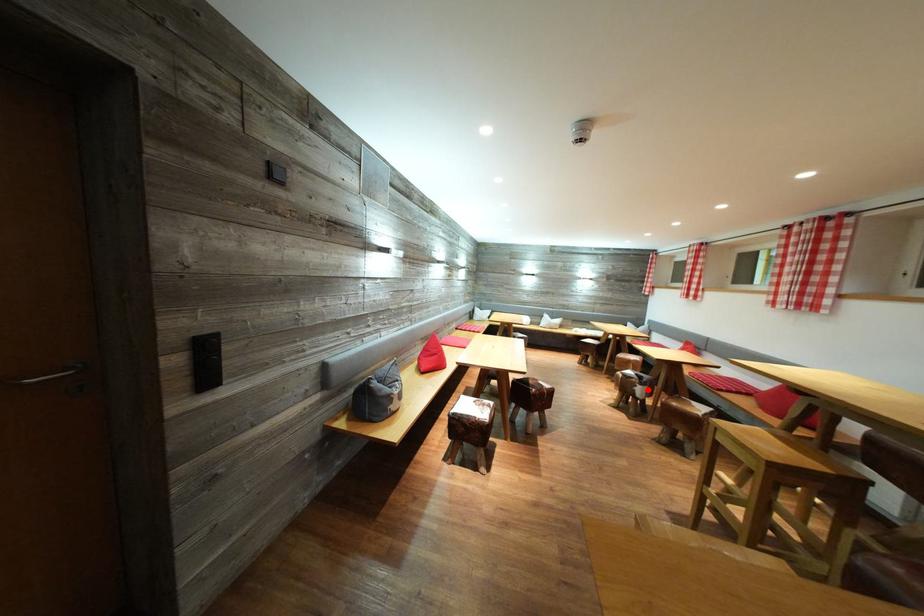
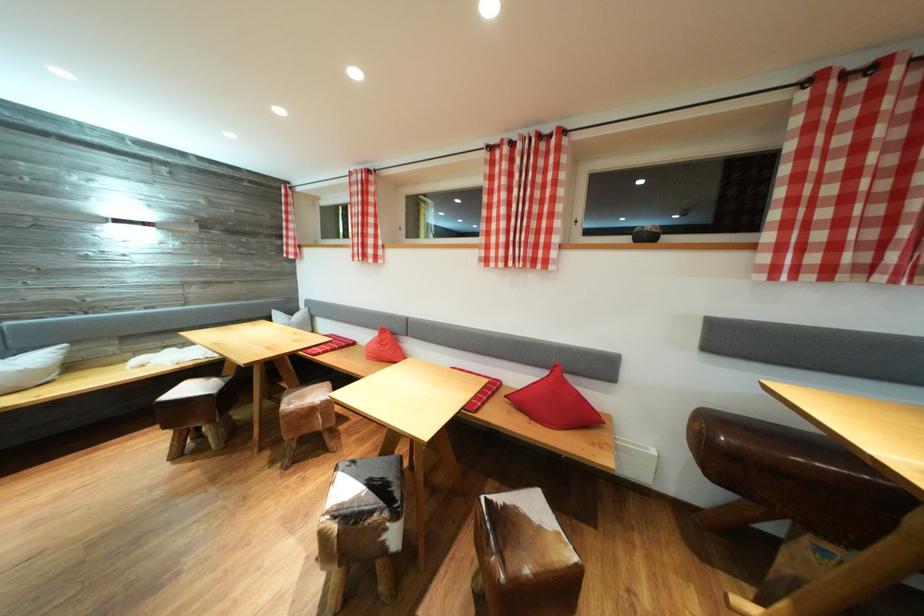
The point at the highlighted location is marked in the first image. Where is the corresponding point in the second image?

(403, 522)